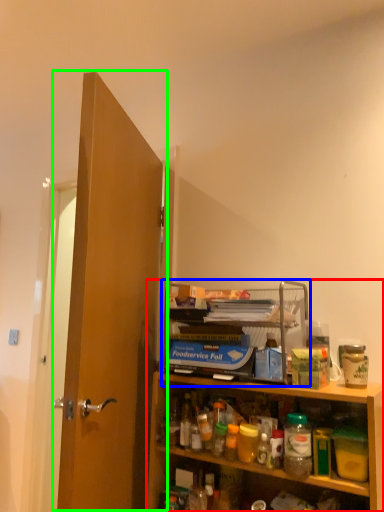
Question: Which object is positioned closest to cabinetry (highlighted by a red box)? Select from shelf (highlighted by a blue box) and door (highlighted by a green box).

Choices:
 (A) shelf
 (B) door

Answer: (A)